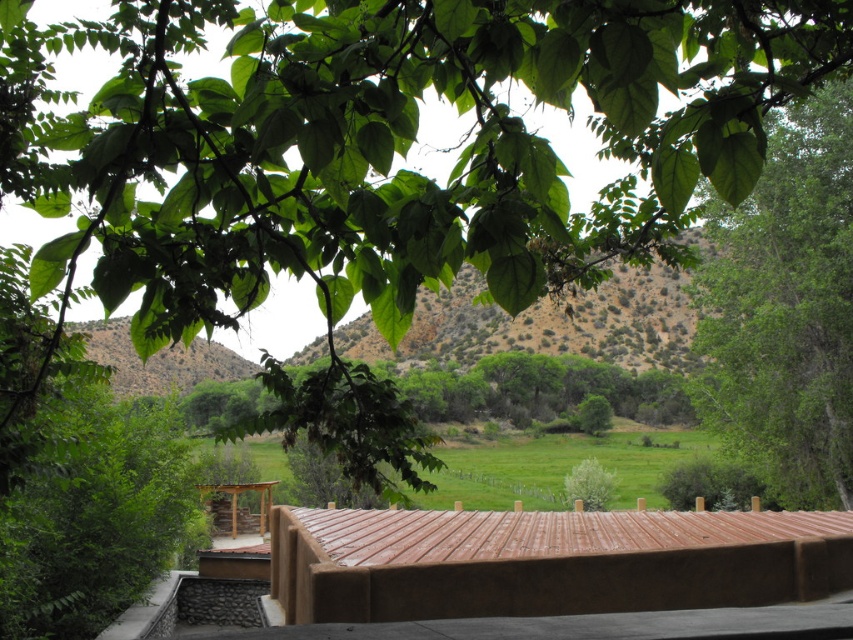
You are standing on a balcony and see the brown corrugated metal roof at center and the green leafy tree at right. Which object is closer to you?

The brown corrugated metal roof at center is closer to you because it is positioned under the green leafy tree at right, indicating it is in front of the tree.

You are standing on the balcony and want to know the exact coordinates of the brown corrugated metal roof at center. What are its coordinates?

The brown corrugated metal roof at center is located at coordinates point (x=547, y=561).

You are standing on a balcony and want to take a photo of the brown corrugated metal roof at center. If your camera can focus on objects up to 10 meters away, will it be able to capture the roof clearly?

The brown corrugated metal roof at center is 9.22 meters away from camera, so yes, the camera can focus on it since the distance is within the 10 meters range.